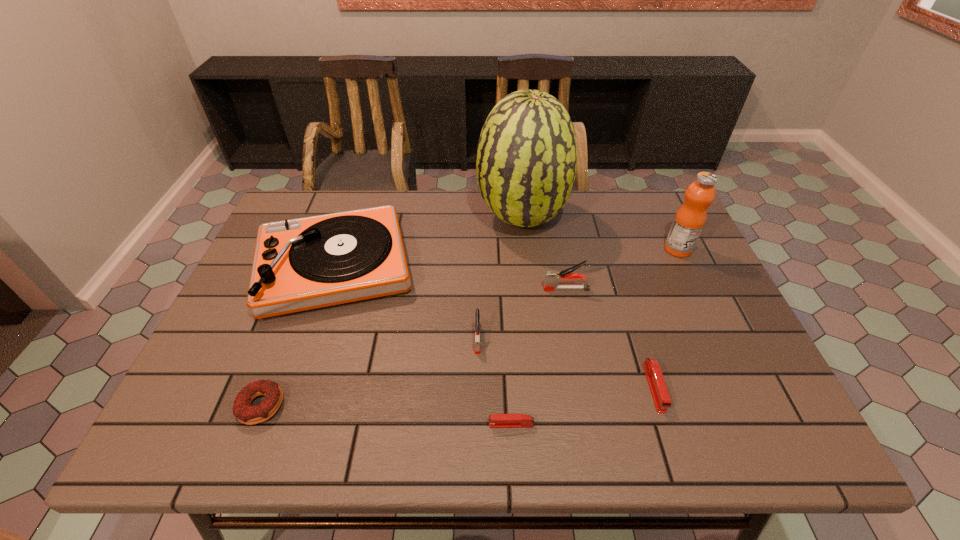
The image size is (960, 540). Identify the location of green watermelon. (526, 163).

Find the location of `the tallest object`. the tallest object is located at coordinates (526, 163).

The image size is (960, 540). I want to click on the rightmost object, so click(x=690, y=218).

Where is `fruit juice`? Image resolution: width=960 pixels, height=540 pixels. fruit juice is located at coordinates (690, 218).

Find the location of a particular element. Image resolution: width=960 pixels, height=540 pixels. record player is located at coordinates (300, 264).

Where is `the tallest stapler`? the tallest stapler is located at coordinates (552, 278).

Locate an element on the screen. the right gray stapler is located at coordinates (552, 278).

Identify the location of the leftmost stapler. [x=477, y=346].

You are a GUI agent. You are given a task and a screenshot of the screen. Output one action in this format:
    pyautogui.click(x=<x>, y=<y>)
    Task: Click on the nearer gray stapler
    
    Given the screenshot: What is the action you would take?
    pyautogui.click(x=477, y=346)

Locate an element on the screen. The image size is (960, 540). the rightmost stapler is located at coordinates (654, 376).